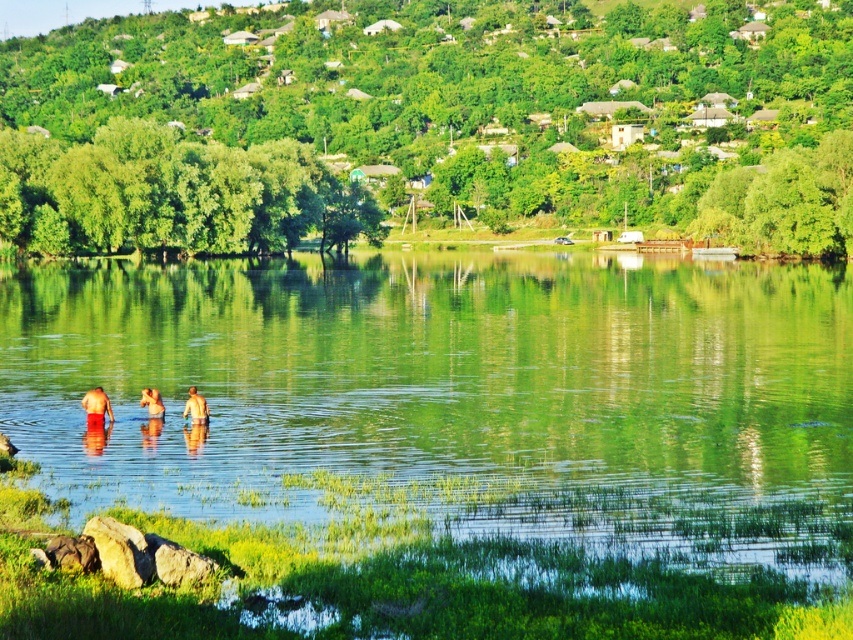
Question: Which of the following is the closest to the observer?

Choices:
 (A) (91, 397)
 (B) (196, 419)

Answer: (A)

Question: Can you confirm if skinny man at center is positioned to the right of smooth skin person at lower center?

Choices:
 (A) no
 (B) yes

Answer: (B)

Question: Does red matte shorts at lower left have a larger size compared to smooth skin person at lower center?

Choices:
 (A) yes
 (B) no

Answer: (A)

Question: Estimate the real-world distances between objects in this image. Which object is closer to the red matte shorts at lower left?

Choices:
 (A) skinny man at center
 (B) green leafy hillside at upper center

Answer: (A)

Question: Is the position of skinny man at center more distant than that of smooth skin person at lower center?

Choices:
 (A) yes
 (B) no

Answer: (B)

Question: Which of the following is the farthest from the observer?

Choices:
 (A) smooth skin person at lower center
 (B) red matte shorts at lower left
 (C) green leafy hillside at upper center

Answer: (C)